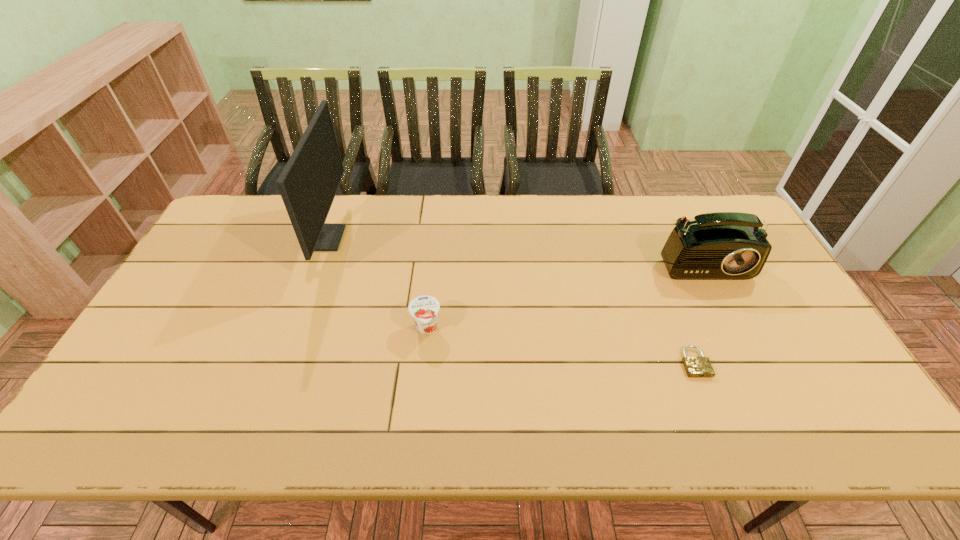
Find the location of a particular element. Image resolution: width=960 pixels, height=540 pixels. free spot between the third shortest object and the nearest object is located at coordinates (696, 306).

At what (x,y) coordinates should I click in order to perform the action: click on blank region between the radio receiver and the shortest object. Please return your answer as a coordinate pair (x, y). The image size is (960, 540). Looking at the image, I should click on (696, 306).

Where is `vacant point located between the shortest object and the yogurt`? The image size is (960, 540). vacant point located between the shortest object and the yogurt is located at coordinates (561, 346).

You are a GUI agent. You are given a task and a screenshot of the screen. Output one action in this format:
    pyautogui.click(x=<x>, y=<y>)
    Task: Click on the free area in between the padlock and the radio receiver
    The image size is (960, 540).
    Given the screenshot: What is the action you would take?
    pyautogui.click(x=696, y=306)

The height and width of the screenshot is (540, 960). Find the location of `free spot between the second nearest object and the leftmost object`. free spot between the second nearest object and the leftmost object is located at coordinates (376, 284).

Locate an element on the screen. vacant area between the third object from right to left and the leftmost object is located at coordinates (376, 284).

This screenshot has width=960, height=540. Find the location of `free area in between the radio receiver and the computer monitor`. free area in between the radio receiver and the computer monitor is located at coordinates (512, 244).

I want to click on vacant point located between the second tallest object and the shortest object, so click(x=696, y=306).

The width and height of the screenshot is (960, 540). Find the location of `vacant region between the second object from left to right and the tallest object`. vacant region between the second object from left to right and the tallest object is located at coordinates (376, 284).

Select which object is the closest to the nearest object. Please provide its 2D coordinates. Your answer should be formatted as a tuple, i.e. [(x, y)], where the tuple contains the x and y coordinates of a point satisfying the conditions above.

[(723, 245)]